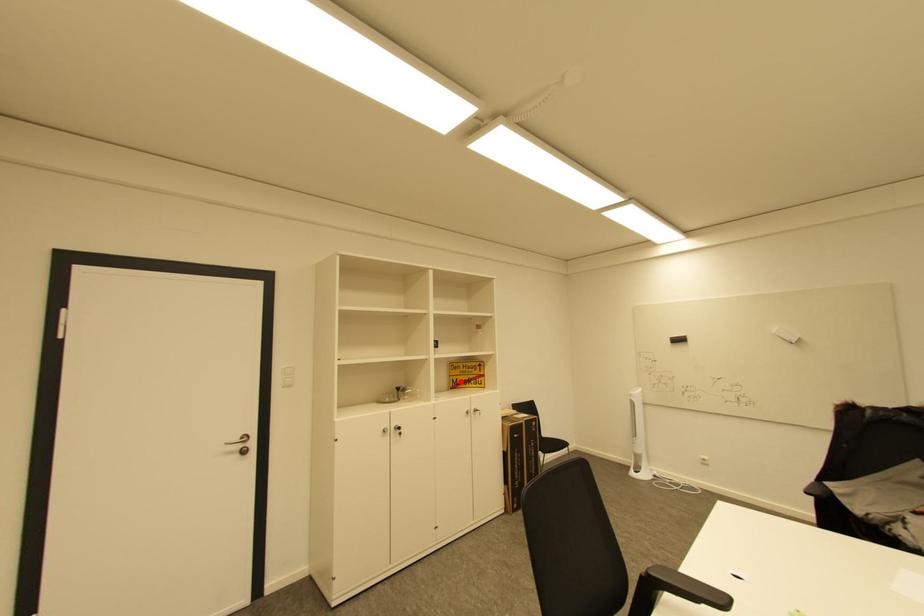
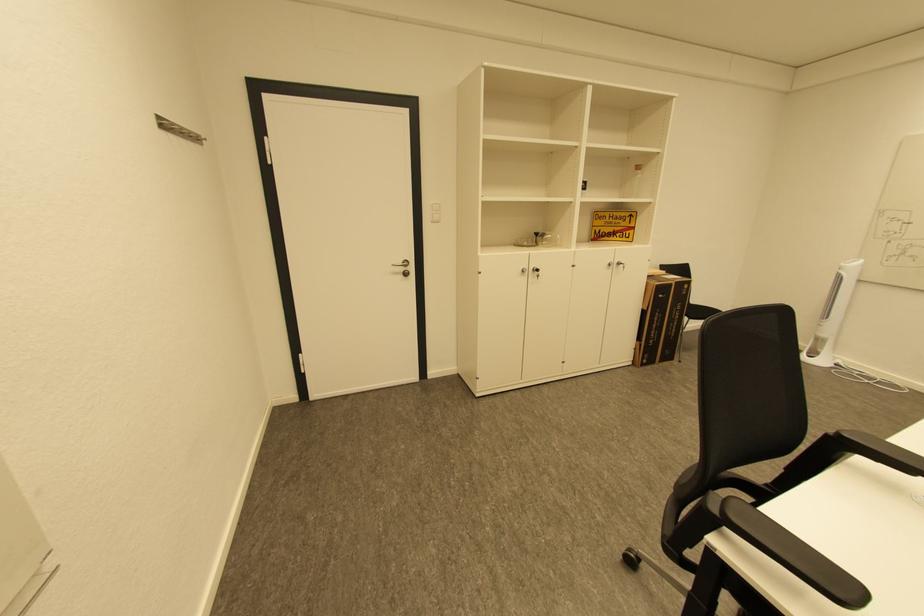
Where in the second image is the point corresponding to the highlighted location from the first image?

(603, 233)